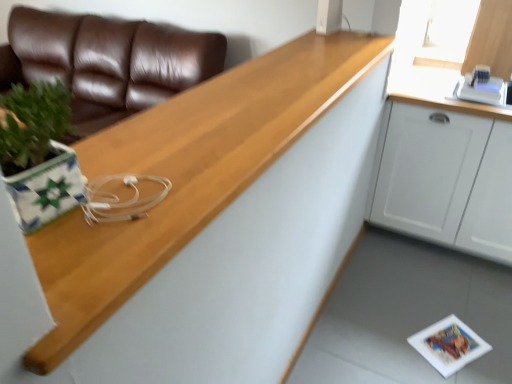
The image size is (512, 384). I want to click on free point above wooden at left (from a real-world perspective), so click(x=250, y=94).